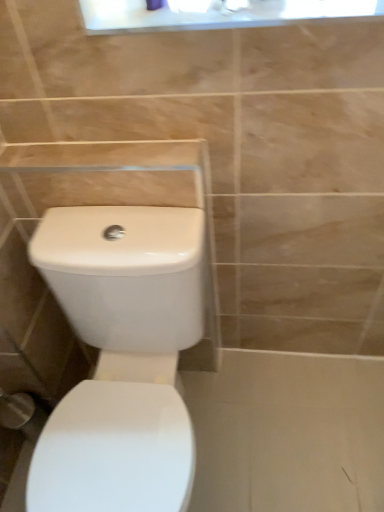
Question: Considering the relative positions of white glossy toilet at center and white glossy medicine cabinet at upper center in the image provided, is white glossy toilet at center to the left of white glossy medicine cabinet at upper center from the viewer's perspective?

Choices:
 (A) yes
 (B) no

Answer: (A)

Question: Could you tell me if white glossy toilet at center is facing white glossy medicine cabinet at upper center?

Choices:
 (A) yes
 (B) no

Answer: (B)

Question: Does white glossy toilet at center have a greater height compared to white glossy medicine cabinet at upper center?

Choices:
 (A) no
 (B) yes

Answer: (B)

Question: Can you confirm if white glossy toilet at center is shorter than white glossy medicine cabinet at upper center?

Choices:
 (A) no
 (B) yes

Answer: (A)

Question: Is white glossy toilet at center not close to white glossy medicine cabinet at upper center?

Choices:
 (A) no
 (B) yes

Answer: (A)

Question: From a real-world perspective, is white glossy toilet at center beneath white glossy medicine cabinet at upper center?

Choices:
 (A) no
 (B) yes

Answer: (B)

Question: Does white glossy medicine cabinet at upper center have a larger size compared to white glossy toilet at center?

Choices:
 (A) no
 (B) yes

Answer: (A)

Question: From the image's perspective, is white glossy medicine cabinet at upper center on white glossy toilet at center?

Choices:
 (A) no
 (B) yes

Answer: (B)

Question: Does white glossy medicine cabinet at upper center appear on the right side of white glossy toilet at center?

Choices:
 (A) yes
 (B) no

Answer: (A)

Question: From the image's perspective, is white glossy medicine cabinet at upper center beneath white glossy toilet at center?

Choices:
 (A) no
 (B) yes

Answer: (A)

Question: Is white glossy medicine cabinet at upper center facing away from white glossy toilet at center?

Choices:
 (A) no
 (B) yes

Answer: (A)

Question: Does white glossy medicine cabinet at upper center come in front of white glossy toilet at center?

Choices:
 (A) no
 (B) yes

Answer: (A)

Question: Considering the positions of white glossy toilet at center and white glossy medicine cabinet at upper center in the image, is white glossy toilet at center bigger or smaller than white glossy medicine cabinet at upper center?

Choices:
 (A) big
 (B) small

Answer: (A)